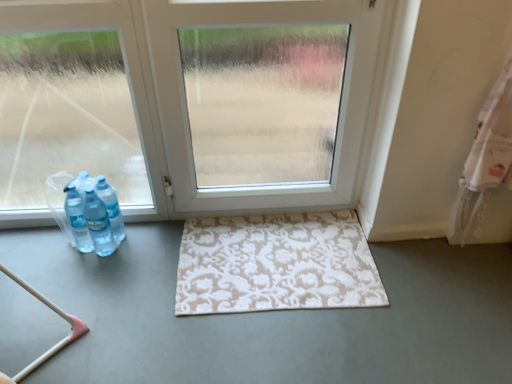
You are a GUI agent. You are given a task and a screenshot of the screen. Output one action in this format:
    pyautogui.click(x=<x>, y=<y>)
    Task: Click on the free space below beige patterned rug at center (from a real-world perspective)
    
    Given the screenshot: What is the action you would take?
    pyautogui.click(x=274, y=258)